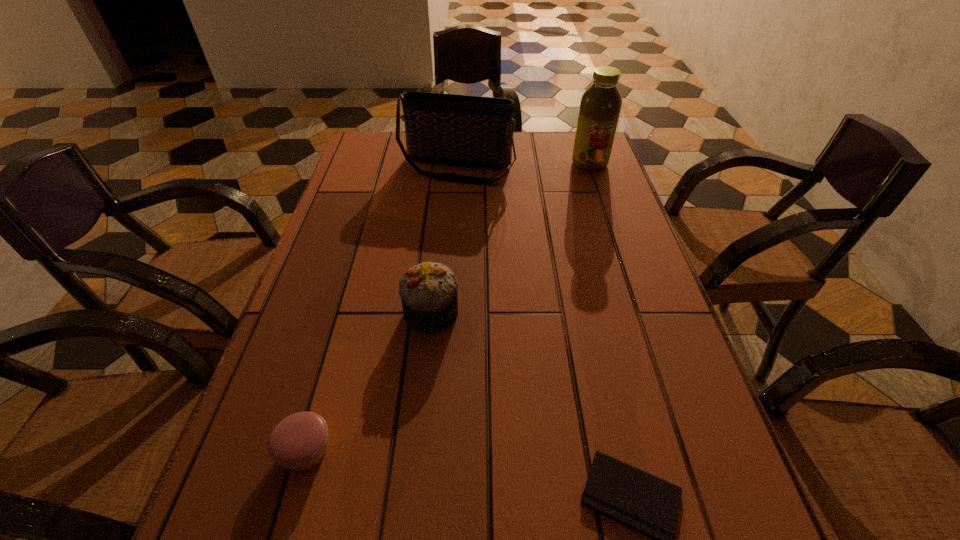
This screenshot has height=540, width=960. I want to click on fruit juice located at the far edge, so click(x=600, y=106).

Find the location of a particular element. handbag situated at the far edge is located at coordinates (475, 131).

Find the location of `handbag situated at the left edge`. handbag situated at the left edge is located at coordinates (475, 131).

Identify the location of cupcake situated at the left edge. (298, 442).

The height and width of the screenshot is (540, 960). In order to click on object located at the right edge in this screenshot , I will do `click(600, 106)`.

Where is `object that is at the far left corner`? object that is at the far left corner is located at coordinates (475, 131).

The height and width of the screenshot is (540, 960). What are the coordinates of `object at the far right corner` in the screenshot? It's located at (600, 106).

You are a GUI agent. You are given a task and a screenshot of the screen. Output one action in this format:
    pyautogui.click(x=<x>, y=<y>)
    Task: Click on the vacant area at the far edge
    
    Given the screenshot: What is the action you would take?
    pyautogui.click(x=513, y=152)

The width and height of the screenshot is (960, 540). In the image, there is a desktop. What are the coordinates of `vacant space at the left edge` in the screenshot? It's located at (361, 340).

Locate an element on the screen. vacant position at the right edge of the desktop is located at coordinates (619, 241).